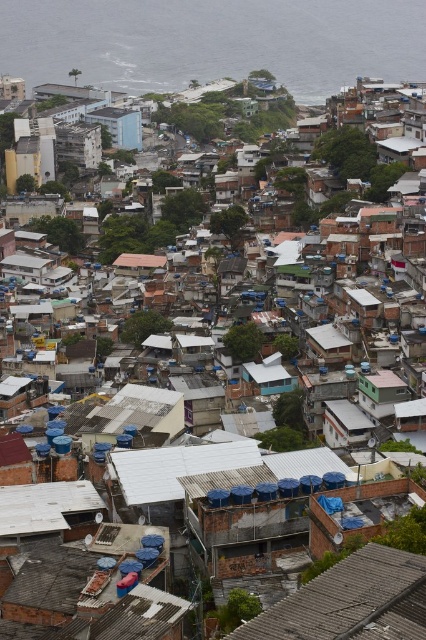
You are a delivery drone trying to navigate between the rusty corrugated metal roof at center and the light blue concrete building at upper center. Which structure should you fly under to avoid hitting the lower one?

You should fly under the rusty corrugated metal roof at center because it has a lesser height compared to the light blue concrete building at upper center, so it is the lower structure.

You are a delivery drone trying to land on the rusty corrugated metal roof at center. The landing coordinates are given as point (351, 602). Is this point on the roof?

Yes, the point (351, 602) is on the rusty corrugated metal roof at center, so the drone can land there.